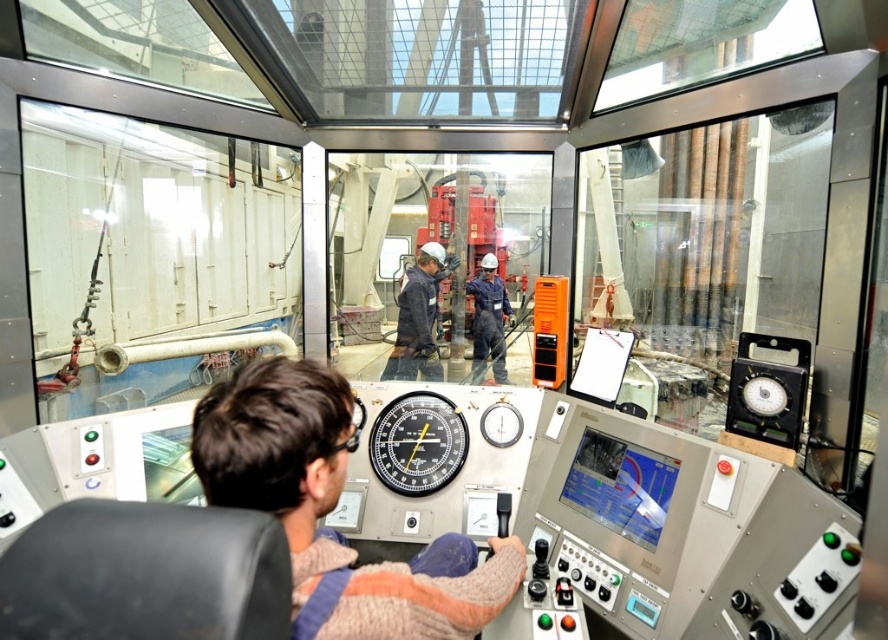
Question: Which is nearer to the blue uniform at center?

Choices:
 (A) dark blue jeans at center
 (B) knitted sweater at center

Answer: (A)

Question: Is knitted sweater at center bigger than black plastic gauge at center?

Choices:
 (A) yes
 (B) no

Answer: (A)

Question: Is knitted sweater at center positioned behind dark blue jeans at center?

Choices:
 (A) yes
 (B) no

Answer: (B)

Question: Which point is closer to the camera taking this photo?

Choices:
 (A) (482, 346)
 (B) (425, 477)
 (C) (397, 360)

Answer: (B)

Question: Considering the relative positions of dark blue jeans at center and blue uniform at center in the image provided, where is dark blue jeans at center located with respect to blue uniform at center?

Choices:
 (A) right
 (B) left

Answer: (B)

Question: Which point is closer to the camera taking this photo?

Choices:
 (A) (393, 378)
 (B) (308, 529)
 (C) (379, 436)

Answer: (B)